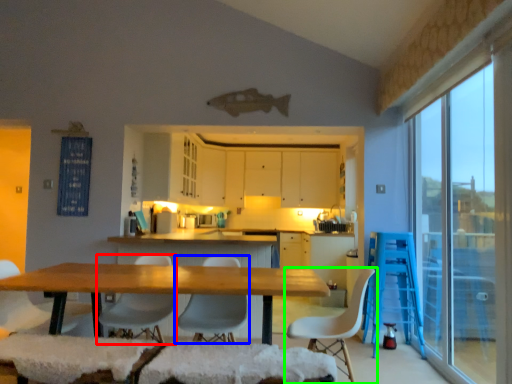
Question: Considering the real-world distances, which object is closest to chair (highlighted by a red box)? chair (highlighted by a blue box) or chair (highlighted by a green box).

Choices:
 (A) chair
 (B) chair

Answer: (A)